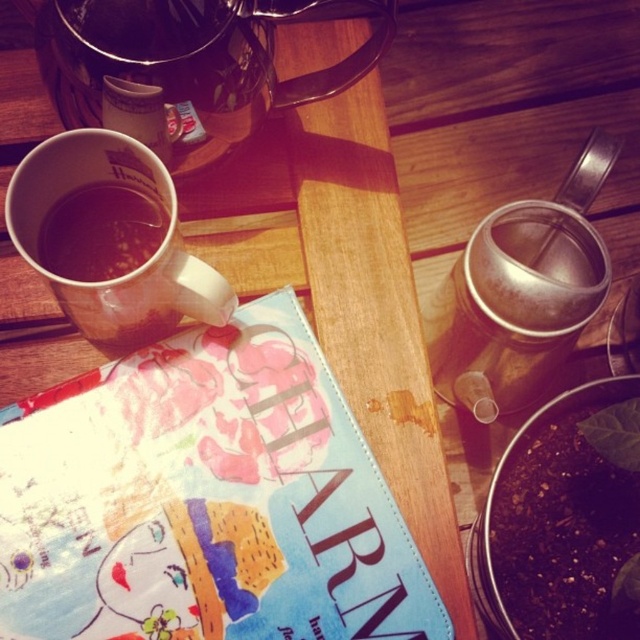
You are sitting at the rustic wooden table and want to pour tea from the brushed metal teapot at upper left into the matte ceramic mug at left. Can you do this without moving either object?

The brushed metal teapot at upper left is above the matte ceramic mug at left, so yes, you can pour tea from the brushed metal teapot at upper left into the matte ceramic mug at left without moving either object because the teapot is positioned higher than the mug.

You are setting up a small table for two guests. You have a matte ceramic mug at left and a brown matte cup at left. Which one should you choose if you want to serve a hot beverage that requires more height to prevent spills?

The matte ceramic mug at left is much taller than the brown matte cup at left, making it a better choice for serving a hot beverage that requires more height to prevent spills.

You are sitting at the rustic wooden table and want to pour tea from the brushed metal teapot at upper left into the brown matte cup at left. Can you do this without moving either object?

The brushed metal teapot at upper left is above the brown matte cup at left, so yes, you can pour tea from the teapot into the cup without needing to move them since the teapot is positioned higher up.